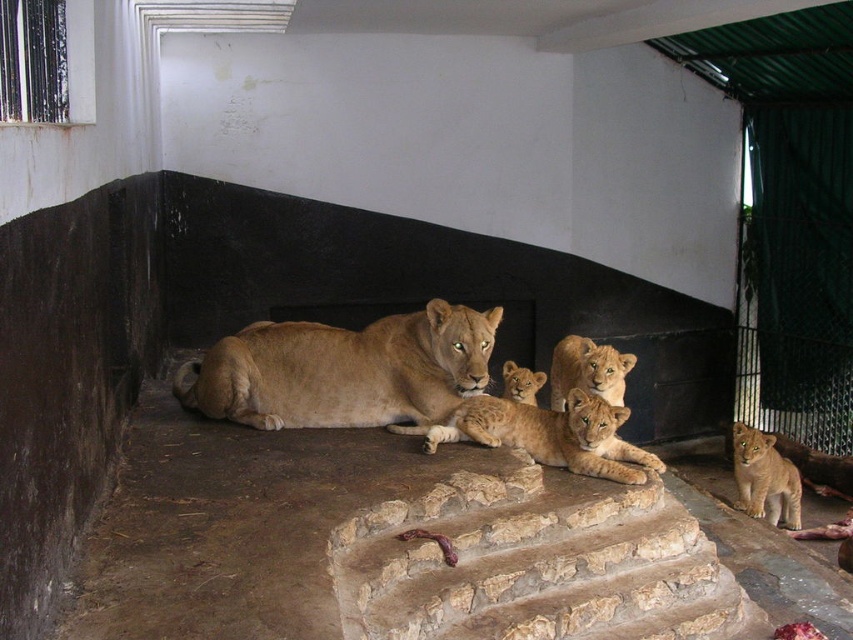
Who is shorter, golden fur lion at center or golden fur lion cubs at center?

Standing shorter between the two is golden fur lion cubs at center.

Can you confirm if golden fur lion at center is positioned below golden fur lion cubs at center?

No, golden fur lion at center is not below golden fur lion cubs at center.

In order to click on golden fur lion at center in this screenshot , I will do `click(344, 371)`.

Locate an element on the screen. The width and height of the screenshot is (853, 640). golden fur lion at center is located at coordinates (344, 371).

Which is behind, point (769, 486) or point (572, 374)?

Positioned behind is point (769, 486).

Can you confirm if golden fur cub at lower right is thinner than golden fur lion cub at center?

No.

Does point (740, 506) come farther from viewer compared to point (561, 344)?

Yes, it is behind point (561, 344).

Image resolution: width=853 pixels, height=640 pixels. I want to click on golden fur cub at lower right, so click(x=764, y=477).

Who is more forward, (433, 305) or (755, 476)?

Point (433, 305) is more forward.

Who is more forward, (428, 307) or (753, 515)?

Answer: Point (428, 307)

Image resolution: width=853 pixels, height=640 pixels. Identify the location of golden fur lion at center. (344, 371).